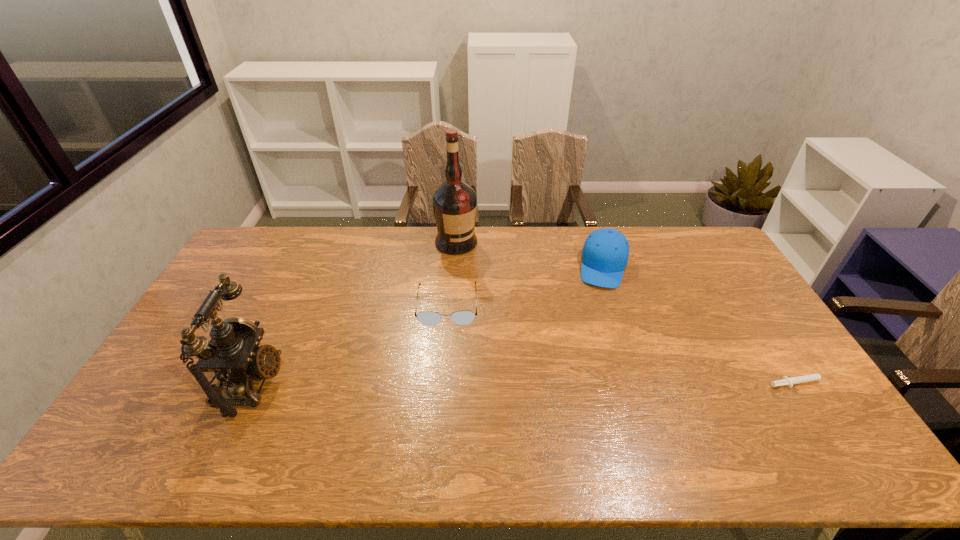
You are a GUI agent. You are given a task and a screenshot of the screen. Output one action in this format:
    pyautogui.click(x=<x>, y=<y>)
    Task: Click on the free spot on the desktop that is between the telephone and the syringe and is positioned on the surface of the liquor
    The width and height of the screenshot is (960, 540).
    Given the screenshot: What is the action you would take?
    pyautogui.click(x=583, y=383)

Locate an element on the screen. This screenshot has width=960, height=540. free spot on the desktop that is between the second tallest object and the syringe and is positioned on the front-facing side of the third tallest object is located at coordinates (583, 383).

Find the location of a particular element. free space on the desktop that is between the telephone and the shortest object and is positioned on the lenses of the spectacles is located at coordinates (444, 383).